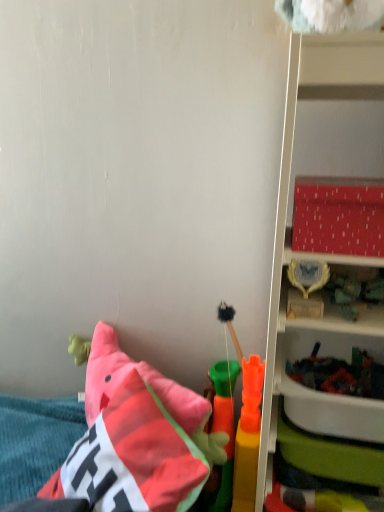
Question: Should I look upward or downward to see matte red plastic shelf at right?

Choices:
 (A) down
 (B) up

Answer: (A)

Question: Does soft fuzzy brush at center, which ranks as the first toy in back-to-front order, have a larger size compared to soft plush pillow at lower left?

Choices:
 (A) yes
 (B) no

Answer: (B)

Question: Considering the relative sizes of soft fuzzy brush at center, the 3th toy from the front, and soft plush pillow at lower left in the image provided, is soft fuzzy brush at center, the 3th toy from the front, thinner than soft plush pillow at lower left?

Choices:
 (A) no
 (B) yes

Answer: (B)

Question: Does soft fuzzy brush at center, the 3th toy from the front, turn towards soft plush pillow at lower left?

Choices:
 (A) no
 (B) yes

Answer: (A)

Question: From the image's perspective, is soft fuzzy brush at center, which ranks as the first toy in back-to-front order, over soft plush pillow at lower left?

Choices:
 (A) yes
 (B) no

Answer: (A)

Question: Is soft fuzzy brush at center, which ranks as the first toy in back-to-front order, to the left of soft plush pillow at lower left from the viewer's perspective?

Choices:
 (A) no
 (B) yes

Answer: (A)

Question: Is soft fuzzy brush at center, the 3th toy from the front, positioned in front of soft plush pillow at lower left?

Choices:
 (A) yes
 (B) no

Answer: (B)

Question: Is soft plush pillow at lower left thinner than rubber carrot at center, which ranks as the second toy in back-to-front order?

Choices:
 (A) yes
 (B) no

Answer: (B)

Question: Is soft plush pillow at lower left bigger than rubber carrot at center, acting as the second toy starting from the front?

Choices:
 (A) no
 (B) yes

Answer: (B)

Question: From the image's perspective, is soft plush pillow at lower left above rubber carrot at center, acting as the second toy starting from the front?

Choices:
 (A) yes
 (B) no

Answer: (A)

Question: Considering the relative positions of soft plush pillow at lower left and rubber carrot at center, acting as the second toy starting from the front, in the image provided, is soft plush pillow at lower left behind rubber carrot at center, acting as the second toy starting from the front,?

Choices:
 (A) yes
 (B) no

Answer: (B)

Question: Is soft plush pillow at lower left completely or partially outside of rubber carrot at center, which ranks as the second toy in back-to-front order?

Choices:
 (A) yes
 (B) no

Answer: (A)

Question: Can you confirm if soft plush pillow at lower left is shorter than rubber carrot at center, acting as the second toy starting from the front?

Choices:
 (A) yes
 (B) no

Answer: (A)

Question: Is rubber carrot at center, which ranks as the second toy in back-to-front order, shorter than smooth plastic toy at lower right, which ranks as the first toy in front-to-back order?

Choices:
 (A) yes
 (B) no

Answer: (B)